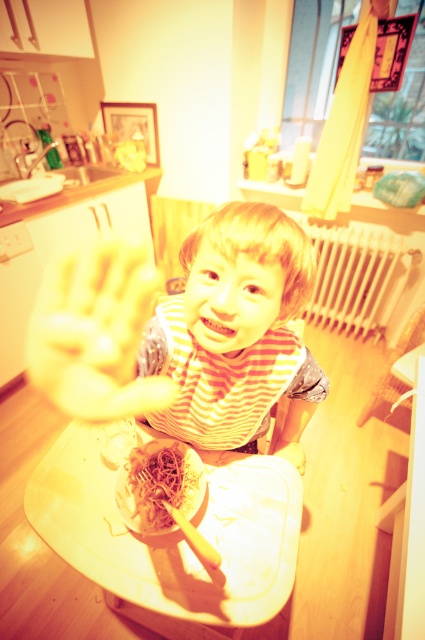
Who is more forward, (x=288, y=538) or (x=170, y=488)?

Point (x=170, y=488) is more forward.

Who is lower down, white plastic tray at lower center or yellowish matte noodles at lower center?

white plastic tray at lower center is below.

The image size is (425, 640). I want to click on white plastic tray at lower center, so click(x=175, y=534).

Which is below, striped fabric toddler at center or yellow matte hand at center?

yellow matte hand at center is below.

Which is in front, point (237, 259) or point (82, 269)?

Point (237, 259) is in front.

Identify the location of striped fabric toddler at center. This screenshot has width=425, height=640. (187, 333).

Where is `striped fabric toddler at center`? The height and width of the screenshot is (640, 425). striped fabric toddler at center is located at coordinates (187, 333).

Is white plastic tray at lower center to the left of yellow matte hand at center from the viewer's perspective?

No, white plastic tray at lower center is not to the left of yellow matte hand at center.

Is point (209, 595) in front of point (150, 292)?

Yes, it is in front of point (150, 292).

I want to click on white plastic tray at lower center, so click(175, 534).